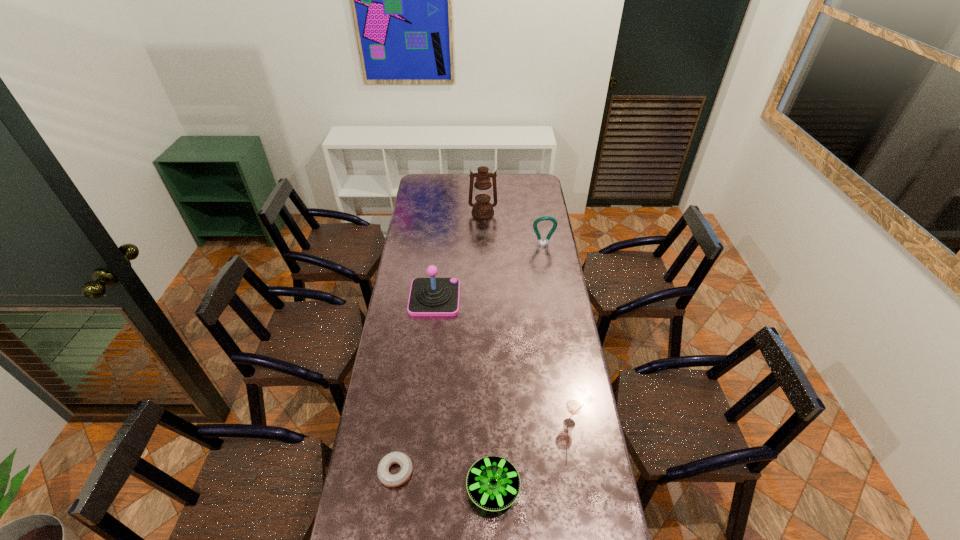
This screenshot has height=540, width=960. I want to click on vacant space situated on the back of the straw, so click(561, 369).

The height and width of the screenshot is (540, 960). I want to click on free point located on the right of the fifth tallest object, so click(604, 488).

Find the location of a particular element. This screenshot has height=540, width=960. free space located on the front of the doughnut is located at coordinates (389, 519).

In order to click on joystick present at the left edge in this screenshot , I will do [x=432, y=296].

This screenshot has height=540, width=960. What are the coordinates of `doughnut positioned at the left edge` in the screenshot? It's located at (391, 480).

This screenshot has width=960, height=540. What are the coordinates of `bottle opener positioned at the right edge` in the screenshot? It's located at (546, 242).

Image resolution: width=960 pixels, height=540 pixels. Identify the location of straw that is positioned at the right edge. (573, 407).

Identify the location of vacant space at the far edge. The image size is (960, 540). (447, 178).

Image resolution: width=960 pixels, height=540 pixels. What are the coordinates of `free location at the left edge` in the screenshot? It's located at (392, 323).

Identify the location of free space at the right edge of the desktop. (540, 200).